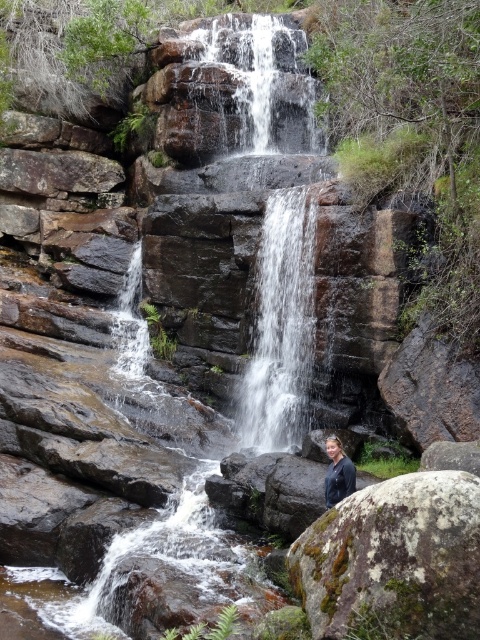
Question: Among these objects, which one is farthest from the camera?

Choices:
 (A) clear water at center
 (B) mossy rock at lower right

Answer: (A)

Question: Observing the image, what is the correct spatial positioning of mossy rock at lower right in reference to clear water at center?

Choices:
 (A) above
 (B) below

Answer: (B)

Question: Can you confirm if clear water at center is smaller than dark blue jacket at center?

Choices:
 (A) no
 (B) yes

Answer: (A)

Question: Estimate the real-world distances between objects in this image. Which object is closer to the dark blue jacket at center?

Choices:
 (A) mossy rock at lower right
 (B) clear water at center

Answer: (A)

Question: Which object is the closest to the mossy rock at lower right?

Choices:
 (A) dark blue jacket at center
 (B) clear water at center

Answer: (A)

Question: Does mossy rock at lower right come behind dark blue jacket at center?

Choices:
 (A) no
 (B) yes

Answer: (A)